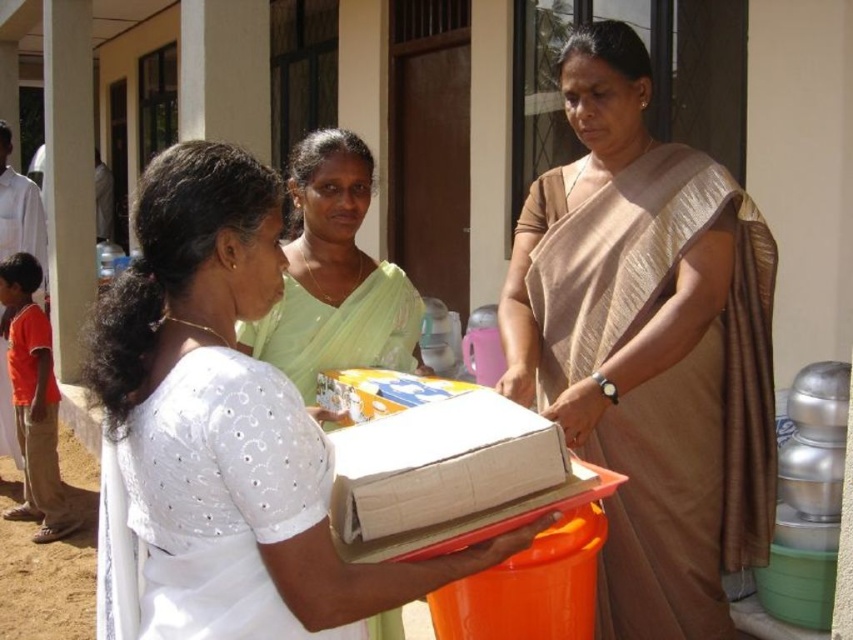
You are a photographer at this event and want to capture both the matte gold sari at center and the light green silk saree at center in a single shot. Based on their positions, which one is closer to the camera?

The matte gold sari at center is positioned under the light green silk saree at center, so the light green silk saree at center is closer to the camera.